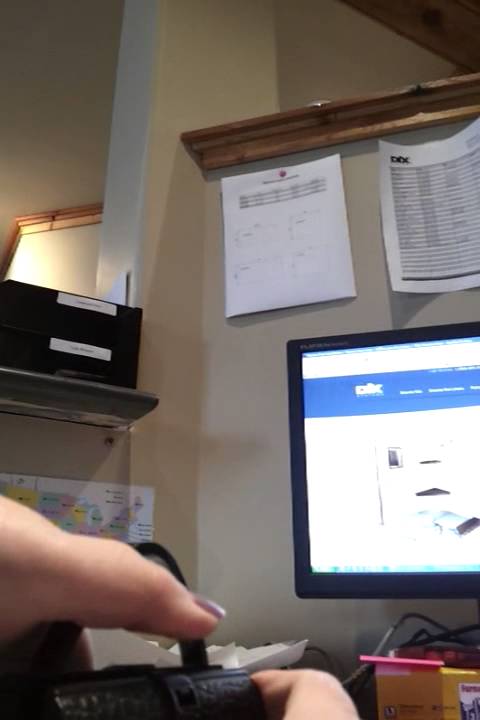
Locate an element on the screen. This screenshot has height=720, width=480. the back wall is located at coordinates (53, 53), (300, 21).